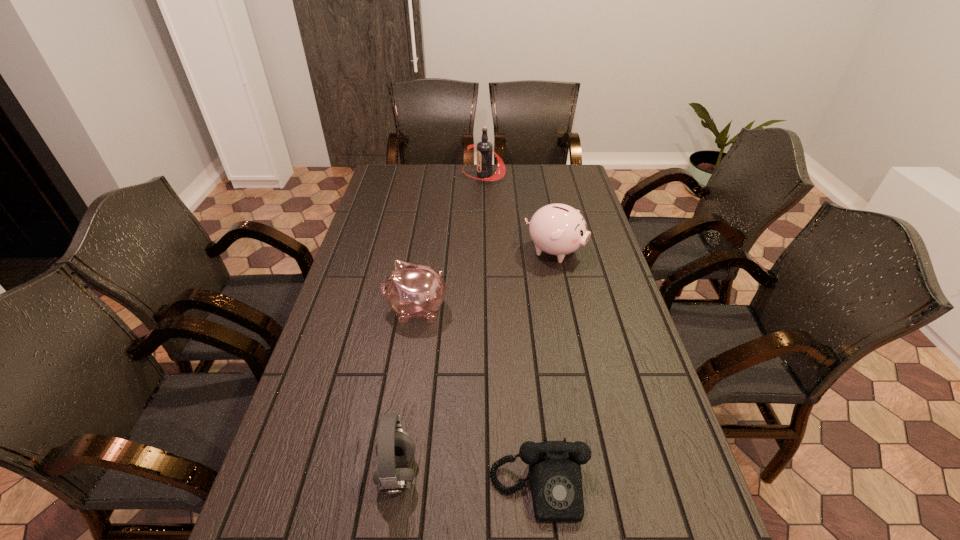
Image resolution: width=960 pixels, height=540 pixels. Identify the location of unoccupied area between the farther piggy bank and the headset. (476, 362).

Find the location of a particular element. This screenshot has height=540, width=960. free space between the telephone and the headset is located at coordinates (468, 481).

Locate an element on the screen. the fourth closest object relative to the headset is located at coordinates (485, 152).

Locate which object is the fourth closest to the farthest object. Please provide its 2D coordinates. Your answer should be formatted as a tuple, i.e. [(x, y)], where the tuple contains the x and y coordinates of a point satisfying the conditions above.

[(555, 477)]

This screenshot has width=960, height=540. I want to click on free space in the image that satisfies the following two spatial constraints: 1. on the label of the tallest object; 2. on the back side of the farther piggy bank, so click(485, 251).

Locate an element on the screen. The height and width of the screenshot is (540, 960). free point that satisfies the following two spatial constraints: 1. on the label of the farther piggy bank; 2. on the right side of the farthest object is located at coordinates (485, 251).

I want to click on free spot that satisfies the following two spatial constraints: 1. on the front side of the fourth nearest object; 2. on the ear cups of the headset, so click(601, 473).

Where is `free spot that satisfies the following two spatial constraints: 1. on the back side of the farther piggy bank; 2. on the label of the farthest object`? The image size is (960, 540). free spot that satisfies the following two spatial constraints: 1. on the back side of the farther piggy bank; 2. on the label of the farthest object is located at coordinates (539, 174).